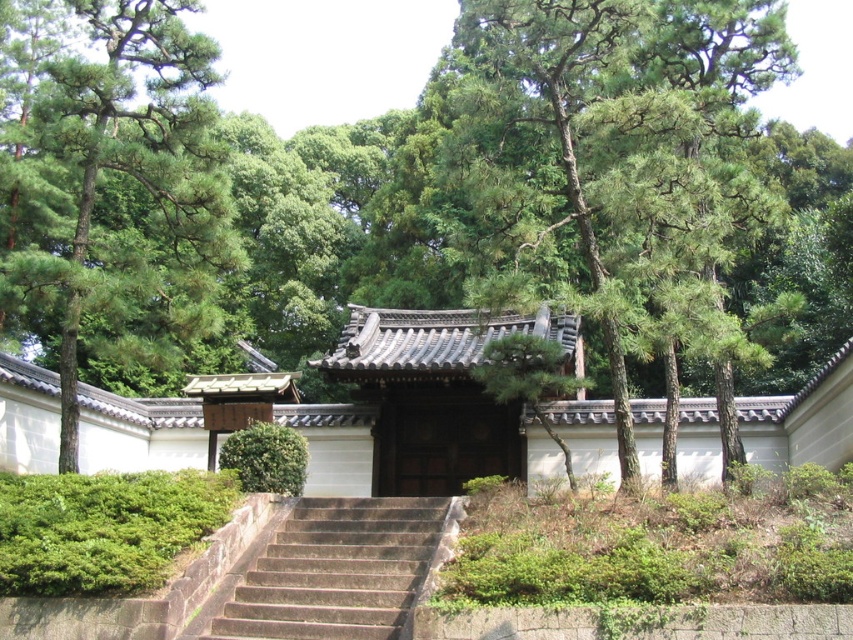
You are a visitor approaching the wooden gatehouse. You see the green leafy tree at left and the brown stone stairs at center. Which object is positioned to the left of the other?

The green leafy tree at left is to the left of brown stone stairs at center.

You are a gardener planning to place a 2 meter wide decorative fountain between the green leafy tree at left and the brown stone stairs at center. Based on their widths, can the fountain fit between them?

The green leafy tree at left might be wider than brown stone stairs at center, so there is uncertainty about whether the 2 meter wide fountain can fit between them. Further measurement is needed to confirm the available space.

You are a visitor approaching the gatehouse and notice the green leafy tree at left and the brown stone stairs at center. Which object appears bigger in the scene?

The green leafy tree at left appears larger than the brown stone stairs at center in the scene.